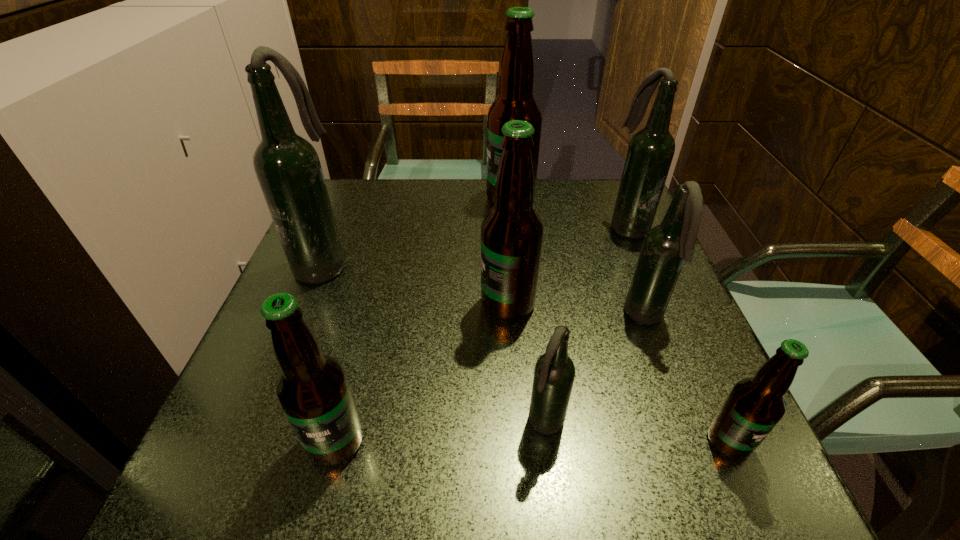
Locate an element on the screen. free location at the far left corner of the desktop is located at coordinates (364, 203).

Identify the location of vacant space at the far right corner of the desktop. Image resolution: width=960 pixels, height=540 pixels. (586, 186).

The image size is (960, 540). Find the location of `vacant point located between the leftmost brown beer bottle and the third smallest brown beer bottle`. vacant point located between the leftmost brown beer bottle and the third smallest brown beer bottle is located at coordinates (421, 373).

Locate an element on the screen. The width and height of the screenshot is (960, 540). free spot between the third smallest dark beer bottle and the smallest dark beer bottle is located at coordinates (587, 325).

I want to click on vacant area that lies between the third nearest dark beer bottle and the second beer bottle from left to right, so click(328, 353).

The height and width of the screenshot is (540, 960). Find the location of `unoccupied position between the smallest brown beer bottle and the second smallest brown beer bottle`. unoccupied position between the smallest brown beer bottle and the second smallest brown beer bottle is located at coordinates (532, 441).

Locate an element on the screen. empty space that is in between the seventh object from right to left and the farthest brown beer bottle is located at coordinates (423, 320).

I want to click on free space between the third smallest brown beer bottle and the third smallest dark beer bottle, so tap(567, 265).

I want to click on vacant space that is in between the smallest brown beer bottle and the third smallest dark beer bottle, so click(x=678, y=334).

I want to click on free space between the leftmost brown beer bottle and the second farthest object, so click(x=482, y=334).